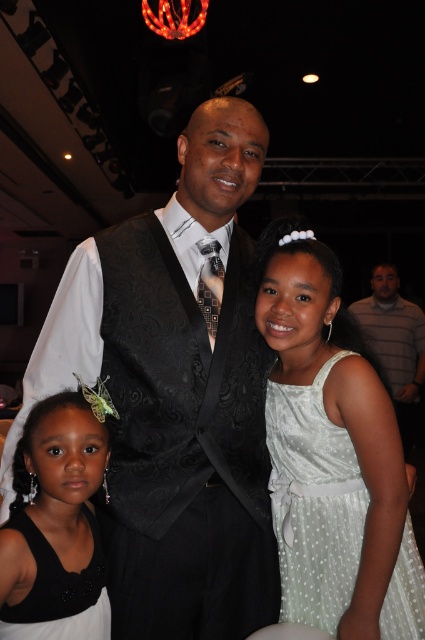
Question: Is white dotted fabric dress at center to the left of striped cotton shirt at upper right from the viewer's perspective?

Choices:
 (A) no
 (B) yes

Answer: (B)

Question: Among these objects, which one is nearest to the camera?

Choices:
 (A) black satin dress at lower left
 (B) white dotted fabric dress at center
 (C) striped cotton shirt at upper right

Answer: (A)

Question: Is white dotted fabric dress at center to the right of black satin dress at lower left from the viewer's perspective?

Choices:
 (A) yes
 (B) no

Answer: (A)

Question: Does black satin dress at lower left appear on the right side of striped cotton shirt at upper right?

Choices:
 (A) no
 (B) yes

Answer: (A)

Question: Which of these objects is positioned closest to the black satin dress at lower left?

Choices:
 (A) striped cotton shirt at upper right
 (B) white dotted fabric dress at center

Answer: (B)

Question: Which is nearer to the striped cotton shirt at upper right?

Choices:
 (A) black satin dress at lower left
 (B) white dotted fabric dress at center

Answer: (B)